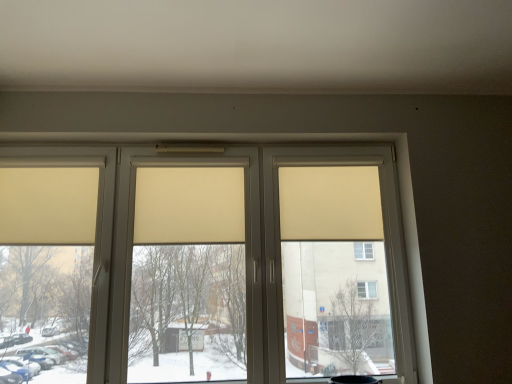
This screenshot has height=384, width=512. What do you see at coordinates (208, 260) in the screenshot? I see `beige matte window at center` at bounding box center [208, 260].

What do you see at coordinates (189, 205) in the screenshot?
I see `beige fabric curtain at center, positioned as the 2th curtain in right-to-left order` at bounding box center [189, 205].

At what (x,y) coordinates should I click in order to perform the action: click on beige fabric curtain at center, which is counted as the 1th curtain, starting from the right. Please return your answer as a coordinate pair (x, y). Looking at the image, I should click on (330, 203).

The height and width of the screenshot is (384, 512). I want to click on beige matte window at center, so click(x=208, y=260).

How different are the orientations of beige fabric curtain at left, which is the 3th curtain in right-to-left order, and beige matte window at center in degrees?

1.24 degrees.

Is beige fabric curtain at left, which is the 3th curtain in right-to-left order, thinner than beige matte window at center?

Correct, the width of beige fabric curtain at left, which is the 3th curtain in right-to-left order, is less than that of beige matte window at center.

From the image's perspective, relative to beige matte window at center, is beige fabric curtain at left, which is the 3th curtain in right-to-left order, above or below?

From the image's perspective, beige fabric curtain at left, which is the 3th curtain in right-to-left order, appears above beige matte window at center.

Could you measure the distance between beige fabric curtain at left, which is the 3th curtain in right-to-left order, and beige matte window at center?

beige fabric curtain at left, which is the 3th curtain in right-to-left order, is 13.41 inches away from beige matte window at center.

From a real-world perspective, is beige fabric curtain at center, placed as the third curtain when sorted from left to right, on beige matte window at center?

Yes, from a real-world perspective, beige fabric curtain at center, placed as the third curtain when sorted from left to right, is over beige matte window at center

Considering the relative sizes of beige fabric curtain at center, which is counted as the 1th curtain, starting from the right, and beige matte window at center in the image provided, is beige fabric curtain at center, which is counted as the 1th curtain, starting from the right, bigger than beige matte window at center?

Actually, beige fabric curtain at center, which is counted as the 1th curtain, starting from the right, might be smaller than beige matte window at center.

Find the location of a particular element. This screenshot has height=384, width=512. the 3rd curtain behind when counting from the beige matte window at center is located at coordinates [330, 203].

Image resolution: width=512 pixels, height=384 pixels. I want to click on the 2nd curtain behind when counting from the beige matte window at center, so click(x=189, y=205).

Could you measure the distance between beige fabric curtain at center, positioned as the 2th curtain in right-to-left order, and beige matte window at center?

They are 7.99 inches apart.

Is beige fabric curtain at center, positioned as the 2th curtain in right-to-left order, wider than beige matte window at center?

Incorrect, the width of beige fabric curtain at center, positioned as the 2th curtain in right-to-left order, does not surpass that of beige matte window at center.

From a real-world perspective, which is physically above, beige fabric curtain at center, the second curtain from the left, or beige matte window at center?

beige fabric curtain at center, the second curtain from the left, from a real-world perspective.

Does point (298, 214) appear closer or farther from the camera than point (13, 212)?

Point (298, 214) is positioned farther from the camera compared to point (13, 212).

Would you say beige fabric curtain at left, which is the 3th curtain in right-to-left order, is part of beige fabric curtain at center, placed as the third curtain when sorted from left to right,'s contents?

No, beige fabric curtain at center, placed as the third curtain when sorted from left to right, does not contain beige fabric curtain at left, which is the 3th curtain in right-to-left order.

Is beige fabric curtain at center, which is counted as the 1th curtain, starting from the right, to the left or to the right of beige fabric curtain at left, which is the 3th curtain in right-to-left order, in the image?

beige fabric curtain at center, which is counted as the 1th curtain, starting from the right, is to the right of beige fabric curtain at left, which is the 3th curtain in right-to-left order.

Is beige fabric curtain at center, which is counted as the 1th curtain, starting from the right, turned away from beige fabric curtain at left, which is the 3th curtain in right-to-left order?

No, beige fabric curtain at left, which is the 3th curtain in right-to-left order, is not at the back of beige fabric curtain at center, which is counted as the 1th curtain, starting from the right.

Is the surface of beige fabric curtain at center, placed as the third curtain when sorted from left to right, in direct contact with beige fabric curtain at center, the second curtain from the left?

No, beige fabric curtain at center, placed as the third curtain when sorted from left to right, is not with beige fabric curtain at center, the second curtain from the left.

Is beige fabric curtain at center, placed as the third curtain when sorted from left to right, oriented away from beige fabric curtain at center, positioned as the 2th curtain in right-to-left order?

No, beige fabric curtain at center, placed as the third curtain when sorted from left to right, is not facing the opposite direction of beige fabric curtain at center, positioned as the 2th curtain in right-to-left order.

Considering the relative sizes of beige fabric curtain at center, which is counted as the 1th curtain, starting from the right, and beige fabric curtain at center, the second curtain from the left, in the image provided, is beige fabric curtain at center, which is counted as the 1th curtain, starting from the right, taller than beige fabric curtain at center, the second curtain from the left,?

Yes, beige fabric curtain at center, which is counted as the 1th curtain, starting from the right, is taller than beige fabric curtain at center, the second curtain from the left.

Could you tell me if beige fabric curtain at left, the first curtain in the left-to-right sequence, is facing beige fabric curtain at center, placed as the third curtain when sorted from left to right?

No, beige fabric curtain at left, the first curtain in the left-to-right sequence, is not oriented towards beige fabric curtain at center, placed as the third curtain when sorted from left to right.

In the image, is beige fabric curtain at left, which is the 3th curtain in right-to-left order, positioned in front of or behind beige fabric curtain at center, which is counted as the 1th curtain, starting from the right?

In the image, beige fabric curtain at left, which is the 3th curtain in right-to-left order, appears in front of beige fabric curtain at center, which is counted as the 1th curtain, starting from the right.

Who is taller, beige fabric curtain at left, which is the 3th curtain in right-to-left order, or beige fabric curtain at center, placed as the third curtain when sorted from left to right?

Standing taller between the two is beige fabric curtain at left, which is the 3th curtain in right-to-left order.

Can you confirm if beige matte window at center is positioned to the right of beige fabric curtain at center, positioned as the 2th curtain in right-to-left order?

Correct, you'll find beige matte window at center to the right of beige fabric curtain at center, positioned as the 2th curtain in right-to-left order.

From a real-world perspective, which object rests below the other?

beige matte window at center, from a real-world perspective.

Measure the distance from beige matte window at center to beige fabric curtain at center, positioned as the 2th curtain in right-to-left order.

beige matte window at center is 7.99 inches away from beige fabric curtain at center, positioned as the 2th curtain in right-to-left order.

Is point (350, 235) positioned behind point (161, 208)?

Yes, it is behind point (161, 208).

Locate an element on the screen. The width and height of the screenshot is (512, 384). window below the beige fabric curtain at left, the first curtain in the left-to-right sequence (from a real-world perspective) is located at coordinates (208, 260).

From the beige matte window at center, count 3rd curtains backward and point to it. Please provide its 2D coordinates.

[(330, 203)]

Considering their positions, is beige fabric curtain at center, which is counted as the 1th curtain, starting from the right, positioned further to beige matte window at center than beige fabric curtain at center, positioned as the 2th curtain in right-to-left order?

beige fabric curtain at center, which is counted as the 1th curtain, starting from the right.

Consider the image. Which object lies further to the anchor point beige fabric curtain at center, the second curtain from the left, beige fabric curtain at center, placed as the third curtain when sorted from left to right, or beige matte window at center?

The object further to beige fabric curtain at center, the second curtain from the left, is beige fabric curtain at center, placed as the third curtain when sorted from left to right.

From the image, which object appears to be nearer to beige fabric curtain at left, the first curtain in the left-to-right sequence, beige fabric curtain at center, positioned as the 2th curtain in right-to-left order, or beige fabric curtain at center, placed as the third curtain when sorted from left to right?

Among the two, beige fabric curtain at center, positioned as the 2th curtain in right-to-left order, is located nearer to beige fabric curtain at left, the first curtain in the left-to-right sequence.

Looking at the image, which one is located closer to beige fabric curtain at center, placed as the third curtain when sorted from left to right, beige fabric curtain at center, positioned as the 2th curtain in right-to-left order, or beige fabric curtain at left, which is the 3th curtain in right-to-left order?

The object closer to beige fabric curtain at center, placed as the third curtain when sorted from left to right, is beige fabric curtain at center, positioned as the 2th curtain in right-to-left order.

Considering their positions, is beige fabric curtain at center, placed as the third curtain when sorted from left to right, positioned closer to beige fabric curtain at left, the first curtain in the left-to-right sequence, than beige matte window at center?

beige matte window at center is closer to beige fabric curtain at left, the first curtain in the left-to-right sequence.

When comparing their distances from beige fabric curtain at center, which is counted as the 1th curtain, starting from the right, does beige fabric curtain at center, the second curtain from the left, or beige matte window at center seem further?

beige fabric curtain at center, the second curtain from the left, is positioned further to the anchor beige fabric curtain at center, which is counted as the 1th curtain, starting from the right.

Based on their spatial positions, is beige fabric curtain at center, positioned as the 2th curtain in right-to-left order, or beige fabric curtain at left, the first curtain in the left-to-right sequence, closer to beige matte window at center?

Among the two, beige fabric curtain at center, positioned as the 2th curtain in right-to-left order, is located nearer to beige matte window at center.

When comparing their distances from beige fabric curtain at center, the second curtain from the left, does beige fabric curtain at left, the first curtain in the left-to-right sequence, or beige matte window at center seem closer?

Based on the image, beige matte window at center appears to be nearer to beige fabric curtain at center, the second curtain from the left.

At what (x,y) coordinates should I click in order to perform the action: click on window situated between beige fabric curtain at left, which is the 3th curtain in right-to-left order, and beige fabric curtain at center, placed as the third curtain when sorted from left to right, from left to right. Please return your answer as a coordinate pair (x, y). The width and height of the screenshot is (512, 384). Looking at the image, I should click on (208, 260).

The width and height of the screenshot is (512, 384). In order to click on curtain situated between beige fabric curtain at left, the first curtain in the left-to-right sequence, and beige matte window at center from left to right in this screenshot , I will do `click(189, 205)`.

What are the coordinates of `window between beige fabric curtain at center, positioned as the 2th curtain in right-to-left order, and beige fabric curtain at center, placed as the third curtain when sorted from left to right, from left to right` in the screenshot? It's located at (208, 260).

Identify the location of curtain between beige fabric curtain at left, which is the 3th curtain in right-to-left order, and beige fabric curtain at center, which is counted as the 1th curtain, starting from the right. (189, 205).